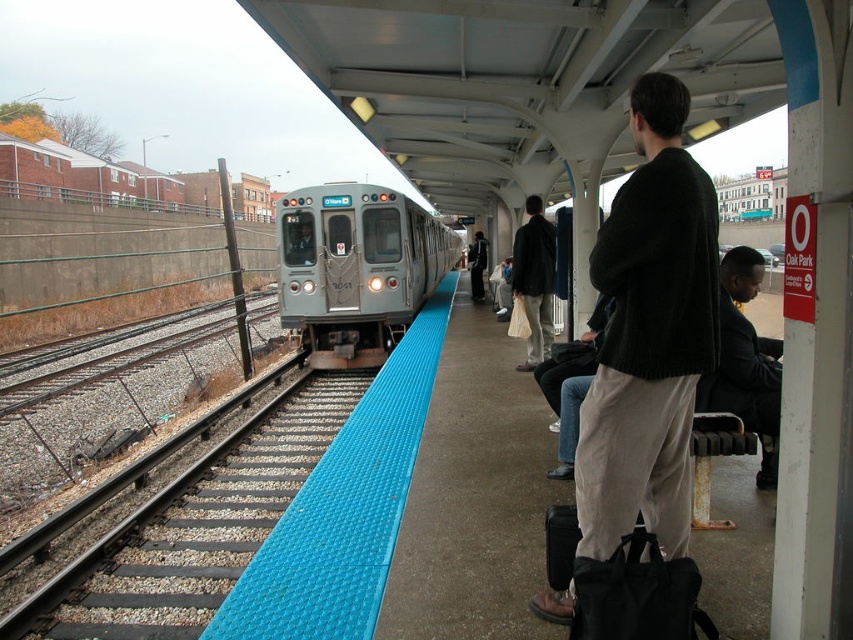
You are standing on the train station platform and notice a person wearing a dark suit at right. Where exactly is this person positioned relative to the platform edge marked by the blue tactile paving strip?

The dark suit at right is located at point 0.566 meters from the left edge and 0.875 meters from the bottom edge of the platform, which places them near the right side but still safely away from the platform edge marked by the blue tactile paving strip.